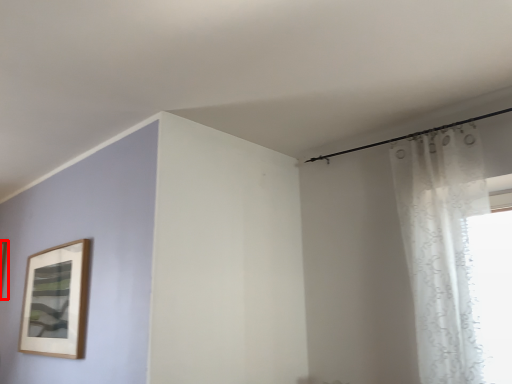
Question: Where is picture frame (annotated by the red box) located in relation to curtain in the image?

Choices:
 (A) right
 (B) left

Answer: (B)